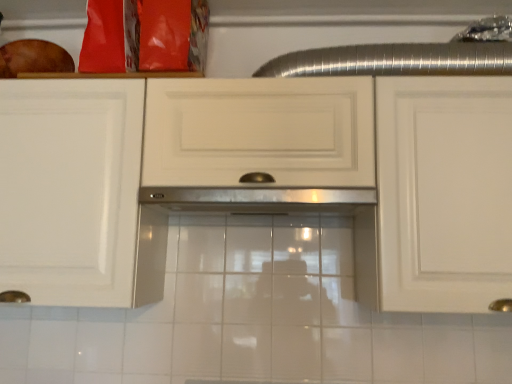
Question: Is white glossy cabinet at center taller than stainless steel exhaust hood at center?

Choices:
 (A) yes
 (B) no

Answer: (A)

Question: From a real-world perspective, is white glossy cabinet at center on stainless steel exhaust hood at center?

Choices:
 (A) no
 (B) yes

Answer: (B)

Question: Could you tell me if white glossy cabinet at center is facing stainless steel exhaust hood at center?

Choices:
 (A) yes
 (B) no

Answer: (A)

Question: Does white glossy cabinet at center have a greater width compared to stainless steel exhaust hood at center?

Choices:
 (A) yes
 (B) no

Answer: (B)

Question: Are white glossy cabinet at center and stainless steel exhaust hood at center beside each other?

Choices:
 (A) no
 (B) yes

Answer: (A)

Question: Does white glossy cabinet at center come in front of stainless steel exhaust hood at center?

Choices:
 (A) yes
 (B) no

Answer: (A)

Question: Considering the relative sizes of stainless steel exhaust hood at center and white glossy cabinet at center in the image provided, is stainless steel exhaust hood at center smaller than white glossy cabinet at center?

Choices:
 (A) yes
 (B) no

Answer: (A)

Question: Is stainless steel exhaust hood at center looking in the opposite direction of white glossy cabinet at center?

Choices:
 (A) no
 (B) yes

Answer: (B)

Question: Considering the relative sizes of stainless steel exhaust hood at center and white glossy cabinet at center in the image provided, is stainless steel exhaust hood at center wider than white glossy cabinet at center?

Choices:
 (A) no
 (B) yes

Answer: (B)

Question: Is stainless steel exhaust hood at center not near white glossy cabinet at center?

Choices:
 (A) no
 (B) yes

Answer: (A)

Question: From the image's perspective, is stainless steel exhaust hood at center under white glossy cabinet at center?

Choices:
 (A) yes
 (B) no

Answer: (A)

Question: From a real-world perspective, does stainless steel exhaust hood at center stand above white glossy cabinet at center?

Choices:
 (A) yes
 (B) no

Answer: (B)

Question: Is point (479, 84) closer or farther from the camera than point (310, 208)?

Choices:
 (A) closer
 (B) farther

Answer: (A)